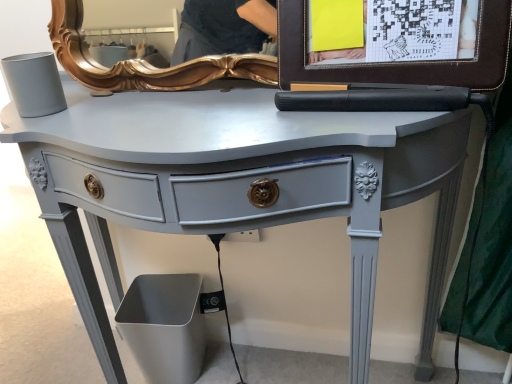
Question: Should I look upward or downward to see brown leather picture frame at upper right?

Choices:
 (A) up
 (B) down

Answer: (A)